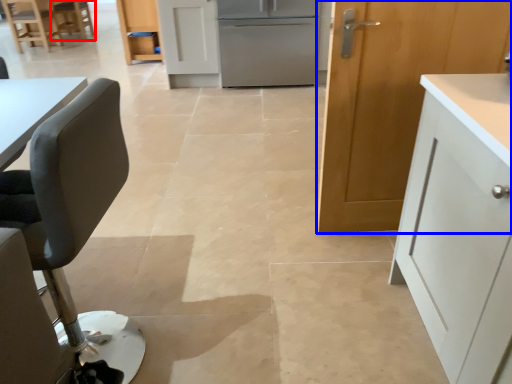
Question: Which object appears closest to the camera in this image, chair (highlighted by a red box) or cabinetry (highlighted by a blue box)?

Choices:
 (A) chair
 (B) cabinetry

Answer: (B)